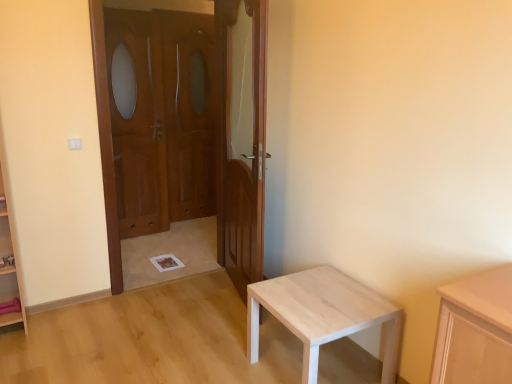
Question: Does wooden at center, placed as the 2th door when sorted from left to right, touch wooden door at left, which ranks as the first door in left-to-right order?

Choices:
 (A) no
 (B) yes

Answer: (A)

Question: From a real-world perspective, is wooden at center, which is the 1th door in right-to-left order, positioned over wooden door at left, placed as the second door when sorted from right to left, based on gravity?

Choices:
 (A) no
 (B) yes

Answer: (A)

Question: Does wooden at center, which is the 1th door in right-to-left order, have a greater width compared to wooden door at left, which ranks as the first door in left-to-right order?

Choices:
 (A) no
 (B) yes

Answer: (B)

Question: Considering the relative positions of wooden at center, which is the 1th door in right-to-left order, and wooden door at left, which ranks as the first door in left-to-right order, in the image provided, is wooden at center, which is the 1th door in right-to-left order, to the left of wooden door at left, which ranks as the first door in left-to-right order, from the viewer's perspective?

Choices:
 (A) yes
 (B) no

Answer: (B)

Question: Is wooden at center, which is the 1th door in right-to-left order, shorter than wooden door at left, which ranks as the first door in left-to-right order?

Choices:
 (A) yes
 (B) no

Answer: (A)

Question: Is wooden at center, placed as the 2th door when sorted from left to right, facing away from wooden door at left, placed as the second door when sorted from right to left?

Choices:
 (A) yes
 (B) no

Answer: (B)

Question: Is light wood table at lower right taller than wooden screen door at center, the 1th screen door in the left-to-right sequence?

Choices:
 (A) no
 (B) yes

Answer: (A)

Question: From the image's perspective, is light wood table at lower right on wooden screen door at center, which is the second screen door from right to left?

Choices:
 (A) no
 (B) yes

Answer: (A)

Question: Is light wood table at lower right placed right next to wooden screen door at center, the 1th screen door in the left-to-right sequence?

Choices:
 (A) no
 (B) yes

Answer: (A)

Question: Can you confirm if light wood table at lower right is positioned to the left of wooden screen door at center, which is the second screen door from right to left?

Choices:
 (A) no
 (B) yes

Answer: (A)

Question: Is light wood table at lower right surrounding wooden screen door at center, which is the second screen door from right to left?

Choices:
 (A) yes
 (B) no

Answer: (B)

Question: Can you confirm if light wood table at lower right is wider than wooden screen door at center, the 1th screen door in the left-to-right sequence?

Choices:
 (A) no
 (B) yes

Answer: (B)

Question: Is wooden door at left, placed as the second door when sorted from right to left, not near wooden screen door at center, which is the second screen door from right to left?

Choices:
 (A) yes
 (B) no

Answer: (B)